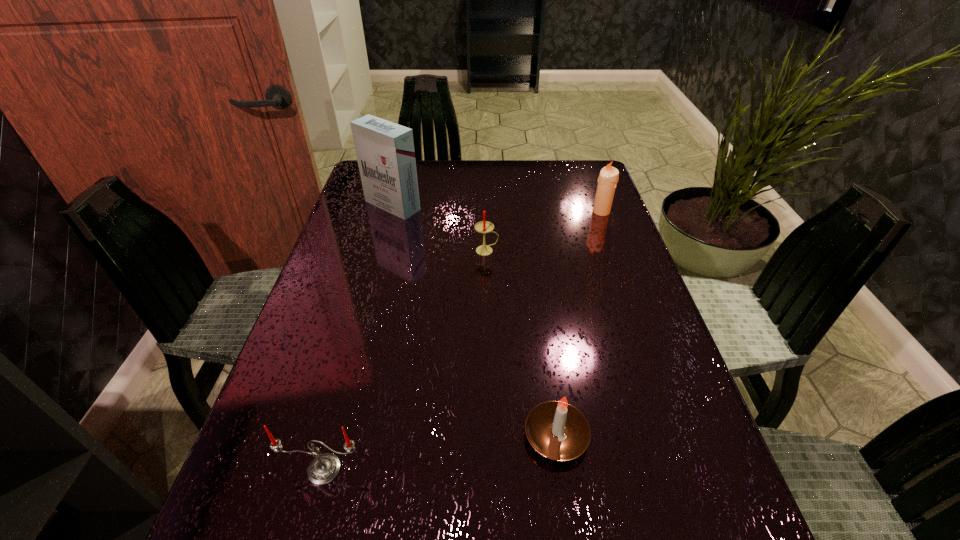
Identify the location of vacant space located 0.300m on the right of the third farthest object. (613, 251).

Where is `vacant space located 0.190m on the left of the second object from right to left`? vacant space located 0.190m on the left of the second object from right to left is located at coordinates (416, 436).

Identify the location of object that is at the far edge. The width and height of the screenshot is (960, 540). (385, 152).

The height and width of the screenshot is (540, 960). Identify the location of cigarette case located in the left edge section of the desktop. (385, 152).

Locate an element on the screen. The height and width of the screenshot is (540, 960). candle present at the left edge is located at coordinates (324, 468).

At what (x,y) coordinates should I click in order to perform the action: click on object at the right edge. Please return your answer as a coordinate pair (x, y). The image size is (960, 540). Looking at the image, I should click on point(608,178).

Find the location of `object situated at the far left corner`. object situated at the far left corner is located at coordinates (385, 152).

What are the coordinates of `free space at the far edge of the desktop` in the screenshot? It's located at (433, 180).

You are a GUI agent. You are given a task and a screenshot of the screen. Output one action in this format:
    pyautogui.click(x=<x>, y=<y>)
    Task: Click on the blank area at the left edge
    
    Given the screenshot: What is the action you would take?
    pyautogui.click(x=345, y=271)

Locate an element on the screen. free space at the right edge of the desktop is located at coordinates (675, 449).